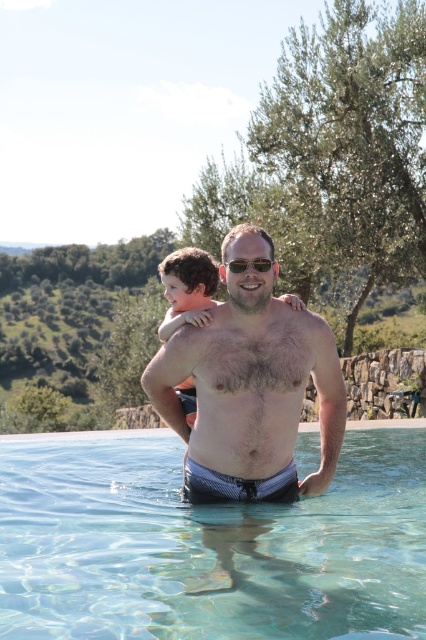
Question: Can you confirm if green leafy olive tree at upper right is bigger than curly brown hair at upper center?

Choices:
 (A) no
 (B) yes

Answer: (B)

Question: Is the position of green leafy olive tree at upper right more distant than that of light brown hair at upper center?

Choices:
 (A) yes
 (B) no

Answer: (A)

Question: Among these points, which one is nearest to the camera?

Choices:
 (A) (187, 275)
 (B) (207, 300)
 (C) (388, 477)

Answer: (A)

Question: Can you confirm if clear glass water at center is bigger than curly brown hair at upper center?

Choices:
 (A) yes
 (B) no

Answer: (B)

Question: Which point is farther from the camera taking this photo?

Choices:
 (A) (268, 269)
 (B) (290, 118)
 (C) (408, 438)

Answer: (B)

Question: Among these points, which one is nearest to the camera?

Choices:
 (A) tap(256, 154)
 (B) tap(317, 509)
 (C) tap(167, 266)
 (D) tap(161, 269)

Answer: (B)